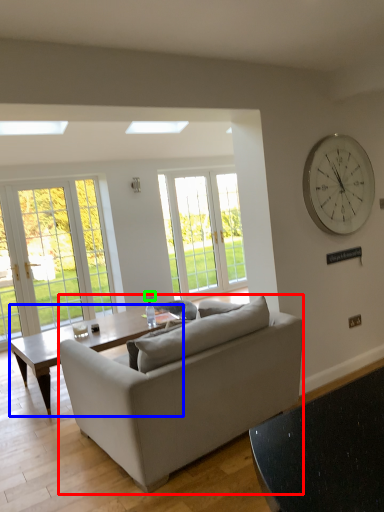
Question: Which is farther away from studio couch (highlighted by a red box)? coffee table (highlighted by a blue box) or power outlet (highlighted by a green box)?

Choices:
 (A) coffee table
 (B) power outlet

Answer: (B)